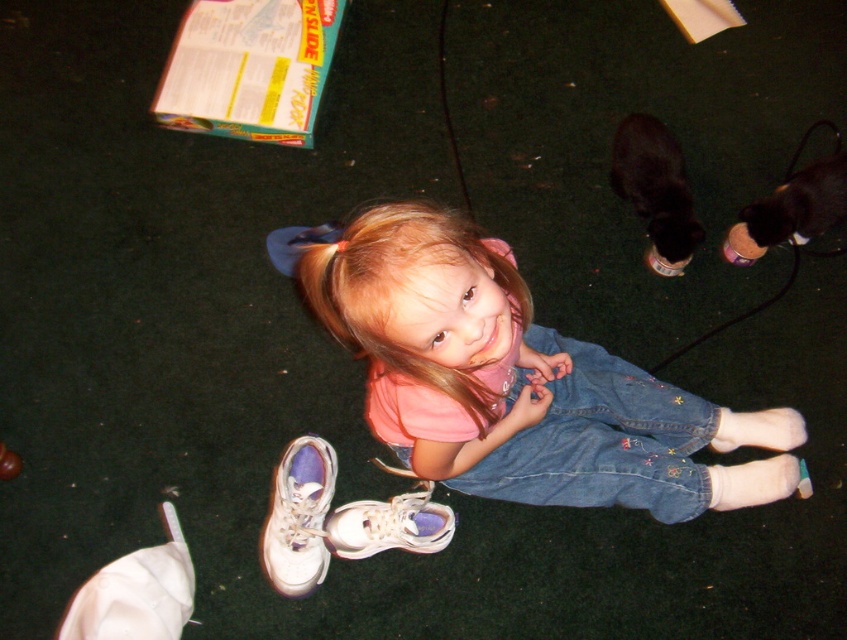
Which of these two, denim at center or white leather sneaker at lower center, stands shorter?

white leather sneaker at lower center

Who is more distant from viewer, (607, 378) or (414, 512)?

The point (607, 378) is more distant.

Does point (495, 486) lie behind point (432, 502)?

That is False.

Locate an element on the screen. The height and width of the screenshot is (640, 847). denim at center is located at coordinates (602, 440).

Does denim at center appear on the right side of white leather shoe at lower center?

Yes, denim at center is to the right of white leather shoe at lower center.

Consider the image. Is denim at center shorter than white leather shoe at lower center?

Incorrect, denim at center's height does not fall short of white leather shoe at lower center's.

Identify the location of denim at center. The image size is (847, 640). (602, 440).

You are a GUI agent. You are given a task and a screenshot of the screen. Output one action in this format:
    pyautogui.click(x=<x>, y=<y>)
    Task: Click on the denim at center
    The image size is (847, 640).
    Given the screenshot: What is the action you would take?
    pyautogui.click(x=602, y=440)

Is pink denim dress at center to the left of white leather shoe at lower center from the viewer's perspective?

Incorrect, pink denim dress at center is not on the left side of white leather shoe at lower center.

Which is more to the right, pink denim dress at center or white leather shoe at lower center?

Positioned to the right is pink denim dress at center.

Is point (655, 401) in front of point (299, 522)?

No, (655, 401) is behind (299, 522).

What are the coordinates of `pink denim dress at center` in the screenshot? It's located at (521, 381).